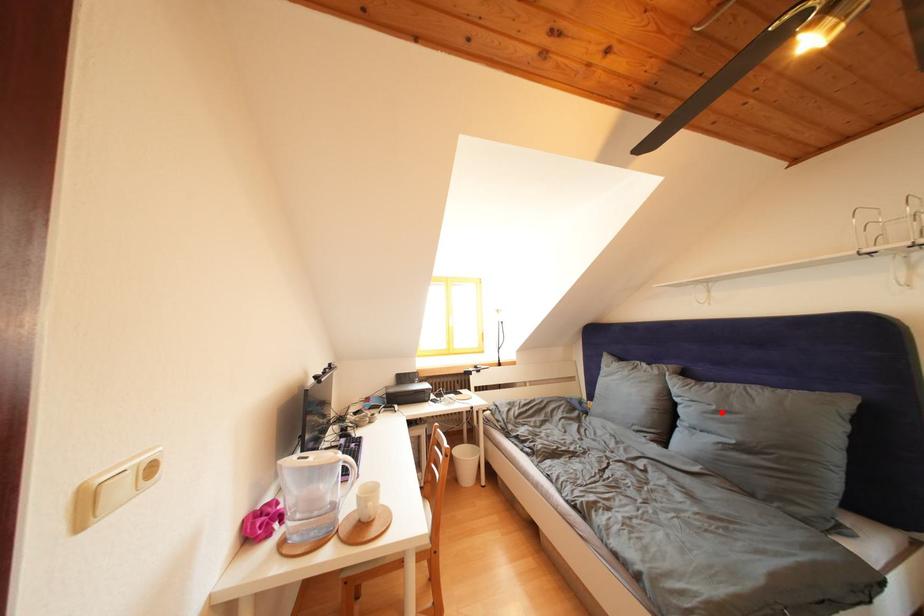
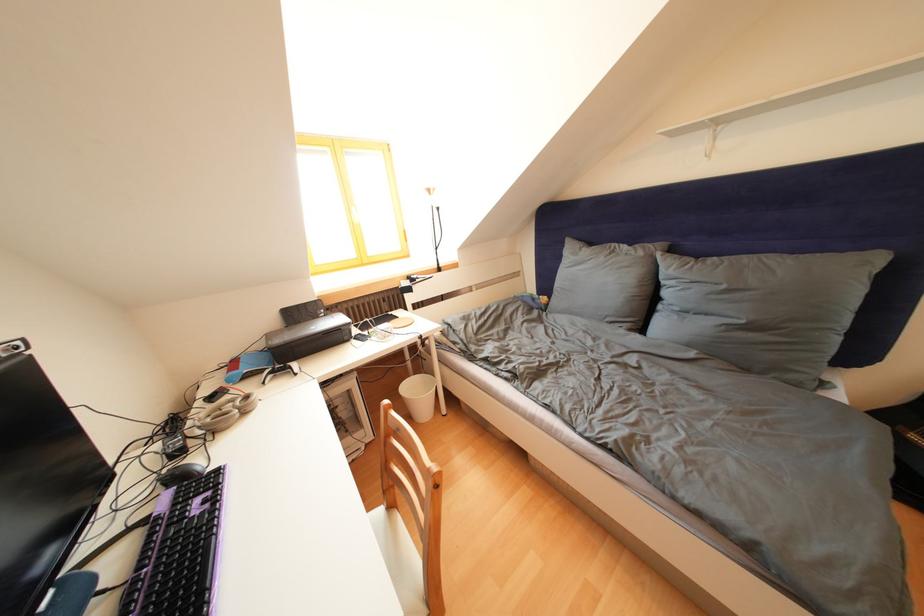
The point at the highlighted location is marked in the first image. Where is the corresponding point in the second image?

(733, 292)